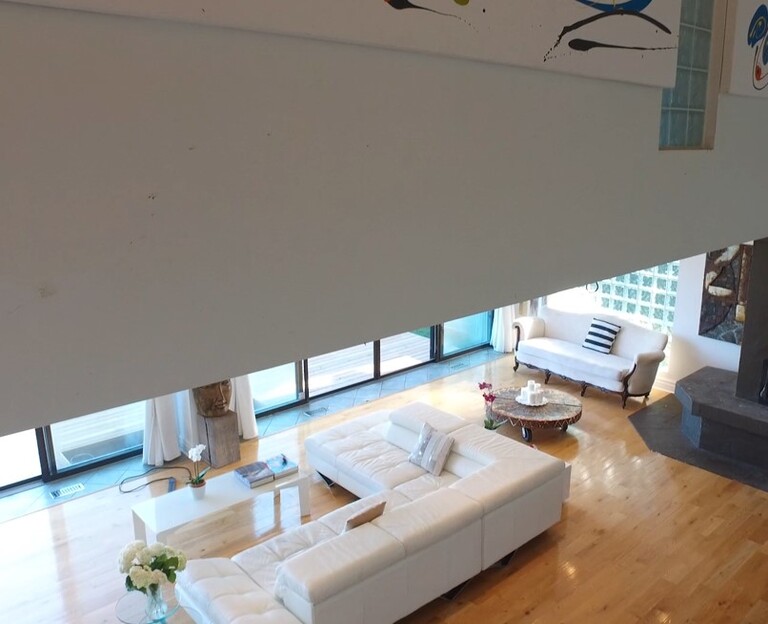
Find the location of a particular element. round coffee table is located at coordinates (560, 422).